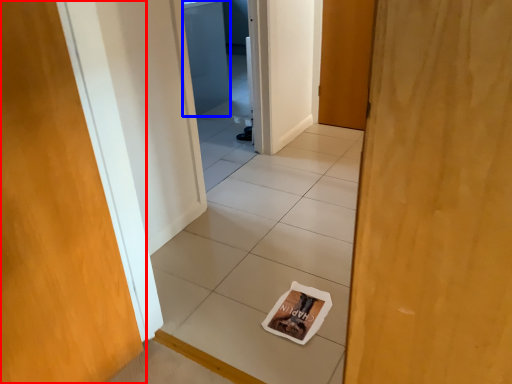
Question: Which of the following is the farthest to the observer, door (highlighted by a red box) or screen door (highlighted by a blue box)?

Choices:
 (A) door
 (B) screen door

Answer: (B)